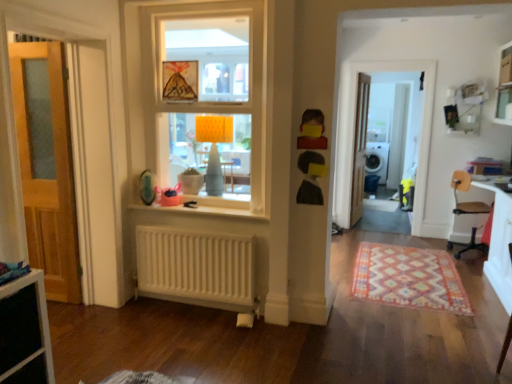
This screenshot has width=512, height=384. What are the coordinates of `pink fabric toy at center, the 3th toy from the right` in the screenshot? It's located at (168, 195).

Find the location of a particular element. The width and height of the screenshot is (512, 384). multicolored woven rug at lower right is located at coordinates (409, 278).

Image resolution: width=512 pixels, height=384 pixels. What are the coordinates of `orange fabric lampshade at upper center` in the screenshot? It's located at (214, 147).

Describe the element at coordinates (359, 148) in the screenshot. I see `wooden door at center, placed as the 2th door when sorted from left to right` at that location.

The width and height of the screenshot is (512, 384). In order to click on wooden door at center, the 2th door in the front-to-back sequence in this screenshot , I will do `click(359, 148)`.

This screenshot has height=384, width=512. Find the location of `yellow matte toy at upper center, acting as the second toy starting from the left`. yellow matte toy at upper center, acting as the second toy starting from the left is located at coordinates (312, 130).

Between white glossy screen door at center, which is the first screen door from right to left, and orange fabric lampshade at upper center, which one is positioned in front?

orange fabric lampshade at upper center is closer to the camera.

Would you consider white glossy screen door at center, arranged as the second screen door when viewed from the front, to be distant from orange fabric lampshade at upper center?

That's right, there is a large distance between white glossy screen door at center, arranged as the second screen door when viewed from the front, and orange fabric lampshade at upper center.

Is white glossy screen door at center, which is counted as the 2th screen door, starting from the left, completely or partially outside of orange fabric lampshade at upper center?

Indeed, white glossy screen door at center, which is counted as the 2th screen door, starting from the left, is completely outside orange fabric lampshade at upper center.

From a real-world perspective, which object rests below the other?

white glossy dishwasher at right is physically lower.

Looking at their sizes, would you say yellow matte toy at upper center, which is counted as the first toy, starting from the front, is wider or thinner than white glossy dishwasher at right?

In the image, yellow matte toy at upper center, which is counted as the first toy, starting from the front, appears to be more narrow than white glossy dishwasher at right.

Can you confirm if yellow matte toy at upper center, which is counted as the first toy, starting from the front, is positioned to the right of white glossy dishwasher at right?

No, yellow matte toy at upper center, which is counted as the first toy, starting from the front, is not to the right of white glossy dishwasher at right.

Is yellow matte toy at upper center, which is counted as the first toy, starting from the front, positioned beyond the bounds of white glossy dishwasher at right?

yellow matte toy at upper center, which is counted as the first toy, starting from the front, is positioned outside white glossy dishwasher at right.

Is white glossy screen door at center, arranged as the second screen door when viewed from the front, touching yellow paper picture frame at upper center?

No, white glossy screen door at center, arranged as the second screen door when viewed from the front, is not touching yellow paper picture frame at upper center.

Could you measure the distance between white glossy screen door at center, which is counted as the 2th screen door, starting from the left, and yellow paper picture frame at upper center?

white glossy screen door at center, which is counted as the 2th screen door, starting from the left, is 17.38 feet from yellow paper picture frame at upper center.

Could you tell me if white glossy screen door at center, acting as the first screen door starting from the back, is turned towards yellow paper picture frame at upper center?

No.

How many degrees apart are the facing directions of yellow paper picture frame at upper center and white glossy screen door at center, which is counted as the 2th screen door, starting from the left?

They differ by 180 degrees in their facing directions.

Based on their sizes in the image, would you say yellow paper picture frame at upper center is bigger or smaller than white glossy screen door at center, acting as the first screen door starting from the back?

Considering their sizes, yellow paper picture frame at upper center takes up less space than white glossy screen door at center, acting as the first screen door starting from the back.

This screenshot has width=512, height=384. What are the coordinates of `picture frame located above the white glossy screen door at center, which is counted as the 2th screen door, starting from the left (from a real-world perspective)` in the screenshot? It's located at (180, 81).

From the image's perspective, is yellow paper picture frame at upper center located above white glossy screen door at center, acting as the first screen door starting from the back?

No, from the image's perspective, yellow paper picture frame at upper center is not above white glossy screen door at center, acting as the first screen door starting from the back.

From a real-world perspective, is white glossy dishwasher at right positioned over white glossy screen door at center, the 2th screen door in the back-to-front sequence, based on gravity?

No.

Is there a large distance between white glossy dishwasher at right and white glossy screen door at center, which ranks as the first screen door in left-to-right order?

Yes, white glossy dishwasher at right is far from white glossy screen door at center, which ranks as the first screen door in left-to-right order.

From the image's perspective, is white glossy dishwasher at right below white glossy screen door at center, the 2th screen door in the back-to-front sequence?

No.

Is white glossy dishwasher at right bigger than white glossy screen door at center, the 2th screen door when ordered from right to left?

Yes.

How different are the orientations of multicolored woven rug at lower right and wooden door at center, which is counted as the first door, starting from the back, in degrees?

The angle between the facing direction of multicolored woven rug at lower right and the facing direction of wooden door at center, which is counted as the first door, starting from the back, is 83.7 degrees.

Is multicolored woven rug at lower right behind wooden door at center, which is counted as the first door, starting from the back?

No, multicolored woven rug at lower right is in front of wooden door at center, which is counted as the first door, starting from the back.

Can we say multicolored woven rug at lower right lies outside wooden door at center, placed as the 2th door when sorted from left to right?

multicolored woven rug at lower right is positioned outside wooden door at center, placed as the 2th door when sorted from left to right.

Could you measure the distance between multicolored woven rug at lower right and wooden door at center, the 2th door in the front-to-back sequence?

multicolored woven rug at lower right and wooden door at center, the 2th door in the front-to-back sequence, are 1.82 meters apart.

Considering the relative sizes of wooden door at left, which appears as the 1th door when viewed from the front, and white glossy screen door at center, the 2th screen door when ordered from right to left, in the image provided, is wooden door at left, which appears as the 1th door when viewed from the front, bigger than white glossy screen door at center, the 2th screen door when ordered from right to left,?

Correct, wooden door at left, which appears as the 1th door when viewed from the front, is larger in size than white glossy screen door at center, the 2th screen door when ordered from right to left.

Does wooden door at left, the 1th door in the left-to-right sequence, have a lesser height compared to white glossy screen door at center, the 2th screen door in the back-to-front sequence?

Yes, wooden door at left, the 1th door in the left-to-right sequence, is shorter than white glossy screen door at center, the 2th screen door in the back-to-front sequence.

From the image's perspective, is wooden door at left, the 1th door in the left-to-right sequence, on white glossy screen door at center, the 2th screen door when ordered from right to left?

Incorrect, from the image's perspective, wooden door at left, the 1th door in the left-to-right sequence, is lower than white glossy screen door at center, the 2th screen door when ordered from right to left.

How far apart are wooden door at left, which appears as the 1th door when viewed from the front, and white glossy screen door at center, the 2th screen door when ordered from right to left?

wooden door at left, which appears as the 1th door when viewed from the front, and white glossy screen door at center, the 2th screen door when ordered from right to left, are 3.44 meters apart from each other.

Locate an element on the screen. This screenshot has width=512, height=384. the 2nd screen door located beneath the orange fabric lampshade at upper center (from a real-world perspective) is located at coordinates (387, 133).

Image resolution: width=512 pixels, height=384 pixels. Identify the location of the 2nd toy counting from the left of the white glossy dishwasher at right. click(312, 130).

Estimate the real-world distances between objects in this image. Which object is closer to wooden door at center, placed as the 2th door when sorted from left to right, yellow paper picture frame at upper center or matte black toy at center, which is the second toy from back to front?

matte black toy at center, which is the second toy from back to front.

Which object lies further to the anchor point multicolored woven rug at lower right, matte black toy at center, which is the second toy from back to front, or wooden door at left, which appears as the 1th door when viewed from the front?

wooden door at left, which appears as the 1th door when viewed from the front.

Looking at the image, which one is located closer to yellow paper picture frame at upper center, white glossy screen door at center, which is the first screen door from right to left, or white painted wood window at center?

white painted wood window at center is closer to yellow paper picture frame at upper center.

From the image, which object appears to be nearer to matte black toy at center, which is counted as the second toy, starting from the front, white matte radiator at lower center or white painted wood window at center?

The object closer to matte black toy at center, which is counted as the second toy, starting from the front, is white painted wood window at center.

From the image, which object appears to be nearer to white glossy screen door at center, which is counted as the 2th screen door, starting from the left, multicolored woven rug at lower right or wooden door at center, the 2th door in the front-to-back sequence?

wooden door at center, the 2th door in the front-to-back sequence, is positioned closer to the anchor white glossy screen door at center, which is counted as the 2th screen door, starting from the left.

When comparing their distances from multicolored woven rug at lower right, does white plastic chair at right or white glossy screen door at center, which is the first screen door from right to left, seem further?

white glossy screen door at center, which is the first screen door from right to left, is positioned further to the anchor multicolored woven rug at lower right.

Which object lies nearer to the anchor point white matte radiator at lower center, yellow paper picture frame at upper center or orange fabric lampshade at upper center?

orange fabric lampshade at upper center is positioned closer to the anchor white matte radiator at lower center.

Based on their spatial positions, is white glossy window sill at center or white glossy screen door at center, acting as the first screen door starting from the back, further from wooden door at center, the 2th door in the front-to-back sequence?

white glossy window sill at center is positioned further to the anchor wooden door at center, the 2th door in the front-to-back sequence.

The width and height of the screenshot is (512, 384). What are the coordinates of `door located between wooden door at left, arranged as the 2th door when viewed from the right, and white plastic chair at right in the left-right direction` in the screenshot? It's located at (359, 148).

Locate an element on the screen. radiator located between wooden door at left, which appears as the 1th door when viewed from the front, and white glossy window sill at center in the left-right direction is located at coordinates (197, 268).

This screenshot has width=512, height=384. I want to click on toy located between wooden door at left, arranged as the 2th door when viewed from the right, and white matte radiator at lower center in the left-right direction, so click(x=168, y=195).

Find the location of a particular element. The image size is (512, 384). window between pink fabric toy at center, placed as the 3th toy when sorted from front to back, and multicolored woven rug at lower right is located at coordinates (209, 91).